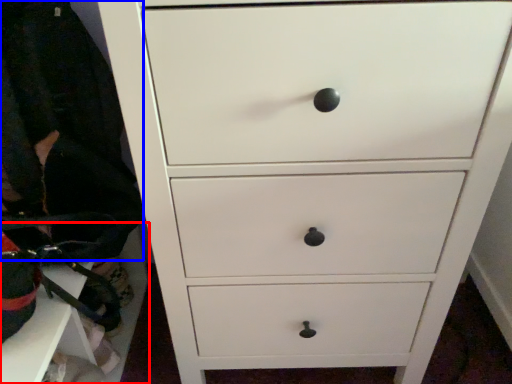
Question: Among these objects, which one is farthest to the camera, cabinetry (highlighted by a red box) or clothing (highlighted by a blue box)?

Choices:
 (A) cabinetry
 (B) clothing

Answer: (A)